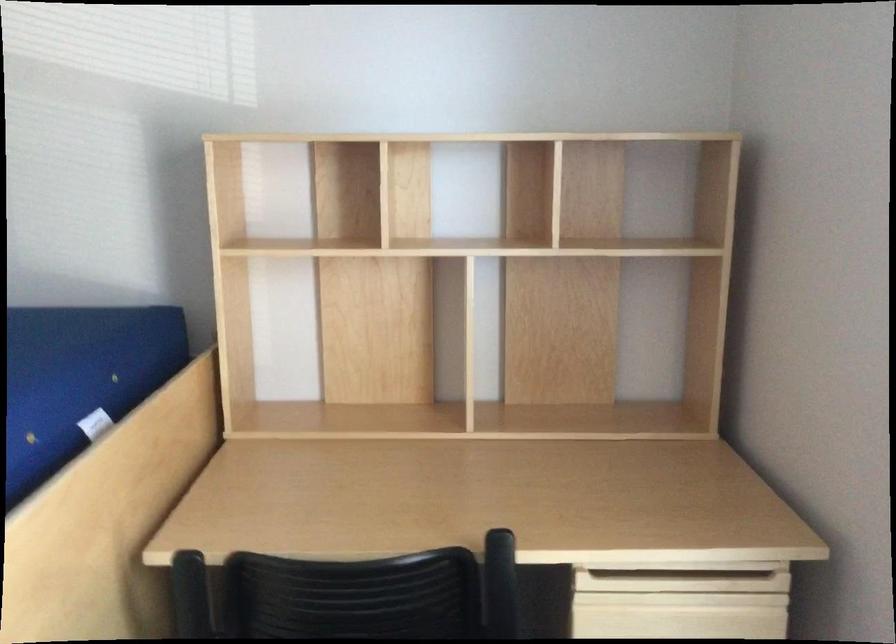
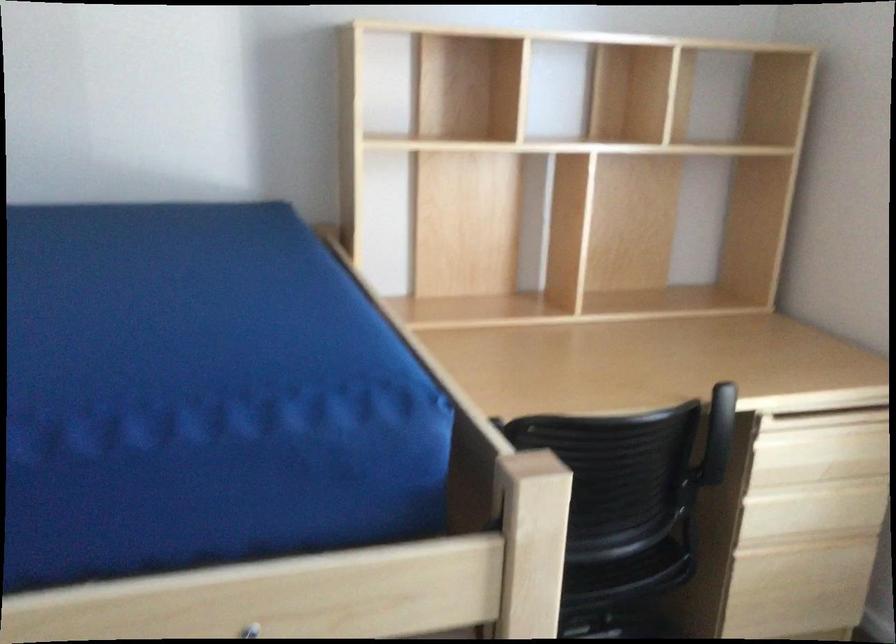
Question: What movement of the cameraman would produce the second image?

Choices:
 (A) Left
 (B) Right
 (C) Forward
 (D) Backward

Answer: (A)